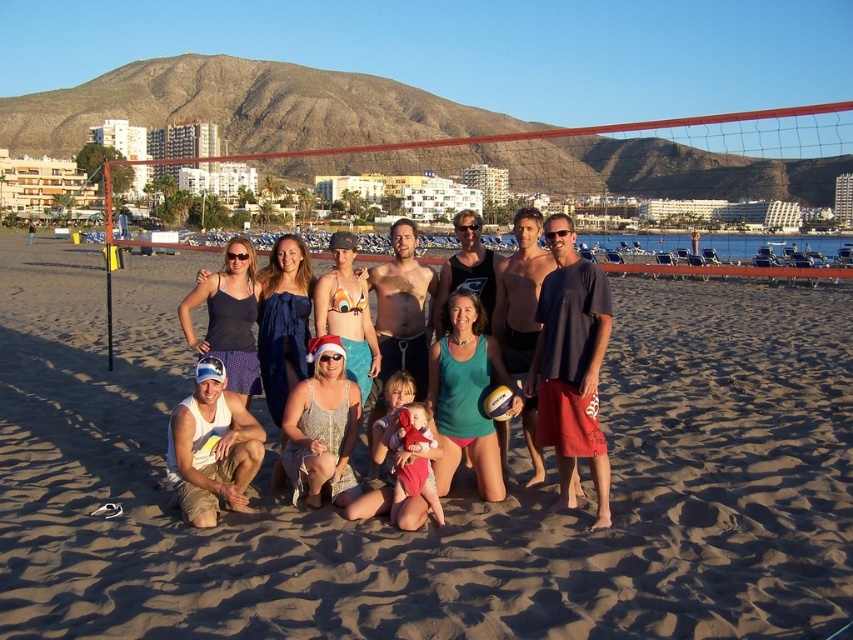
You are standing at the position of point (x=229, y=508) and want to move towards point (x=491, y=468). Which direction should you move in relation to your current position?

You should move forward because point (x=491, y=468) is closer to the camera than point (x=229, y=508), so moving forward from your current position will take you toward it.

Based on the photo, you are standing at the beach and see the white tank top at lower left and the yellow rubber volleyball at center. Which object is nearer to you?

The white tank top at lower left is closer to the viewer than the yellow rubber volleyball at center.

From the picture: You are organizing a beach volleyball tournament and need to choose the right ball for the game. According to the image, which ball has a larger size between the matte black volleyball at center and the yellow rubber volleyball at center?

The matte black volleyball at center has a larger size than the yellow rubber volleyball at center, as its width surpasses the latter.